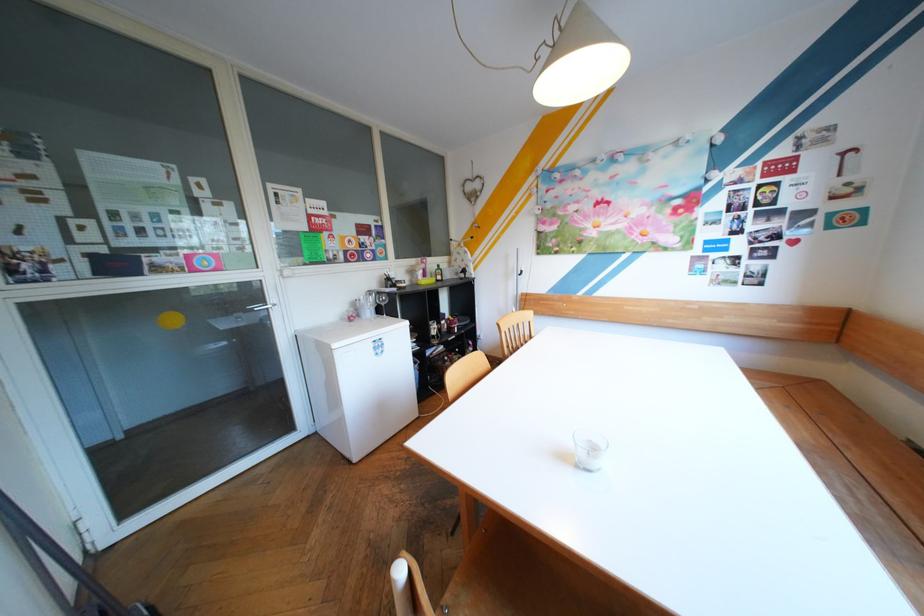
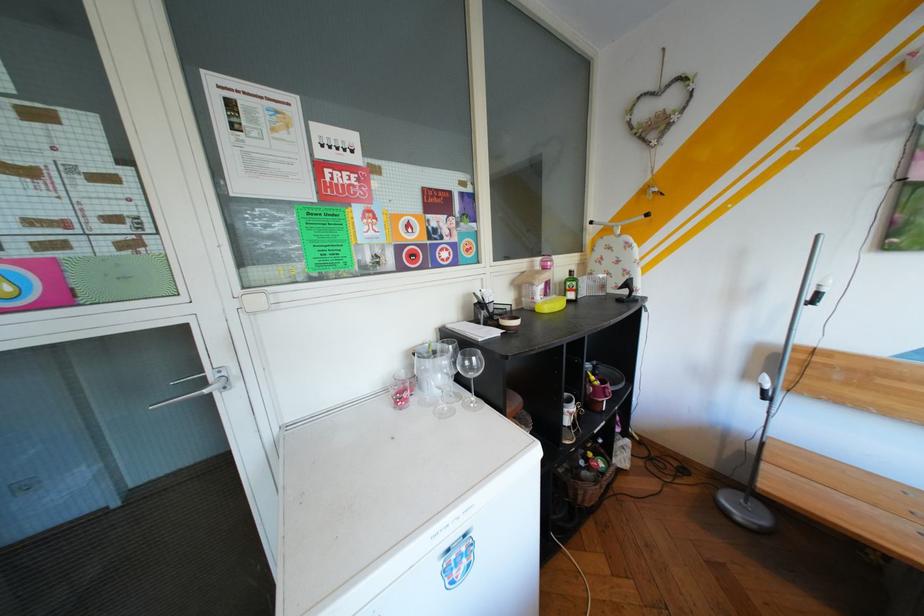
In the second image, find the point that corresponds to pixel 407 285 in the first image.

(505, 320)